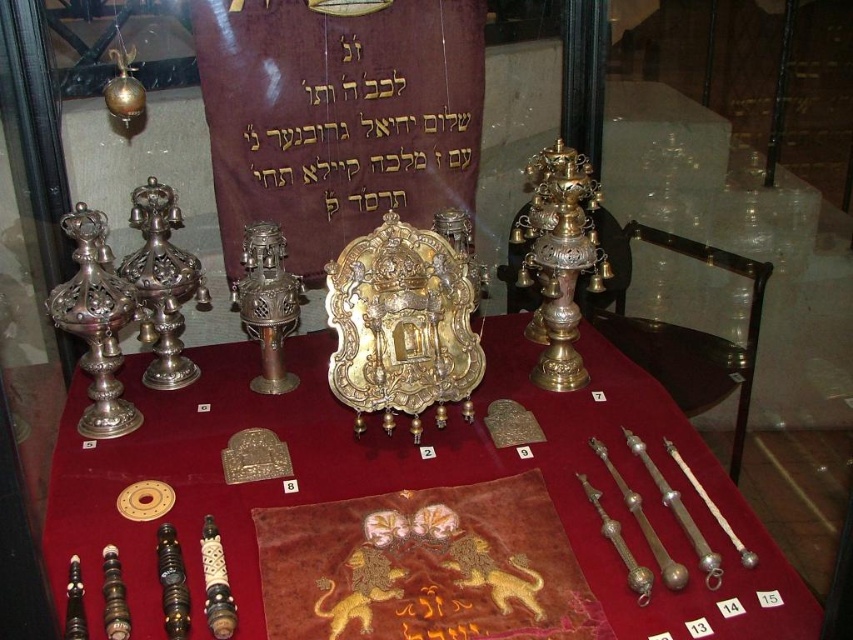
You are a museum visitor observing the religious artifacts displayed on the table. You notice the shiny gold plate at center and the gold metallic text at center. Which object is positioned lower on the table?

The shiny gold plate at center is located below the gold metallic text at center, so it is positioned lower on the table.

You are a museum curator planning to rearrange the artifacts. The shiny gold plate at center and the gold metallic text at center are currently 45.26 centimeters apart. If you want to place them closer together to save space, what is the minimum distance you need to move one of them to achieve a separation of 30 centimeters?

To reduce the distance between the shiny gold plate at center and the gold metallic text at center from 45.26 cm to 30 cm, you need to move one of them by 7.63 centimeters toward the other. This calculation is derived from the difference between the original and desired distances divided by two, assuming both are moved equally. However, moving just one by the full difference of 15.26 cm would also achieve the desired separation.